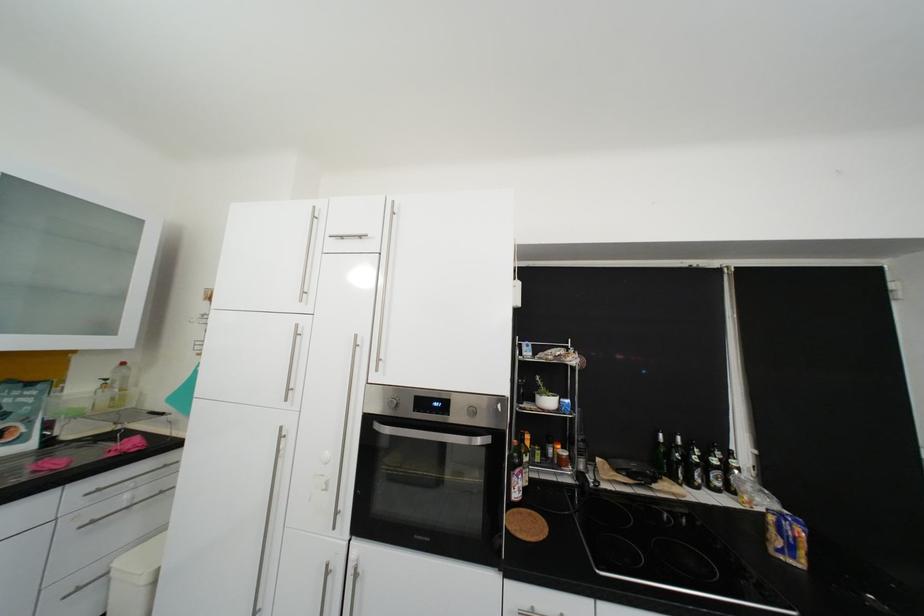
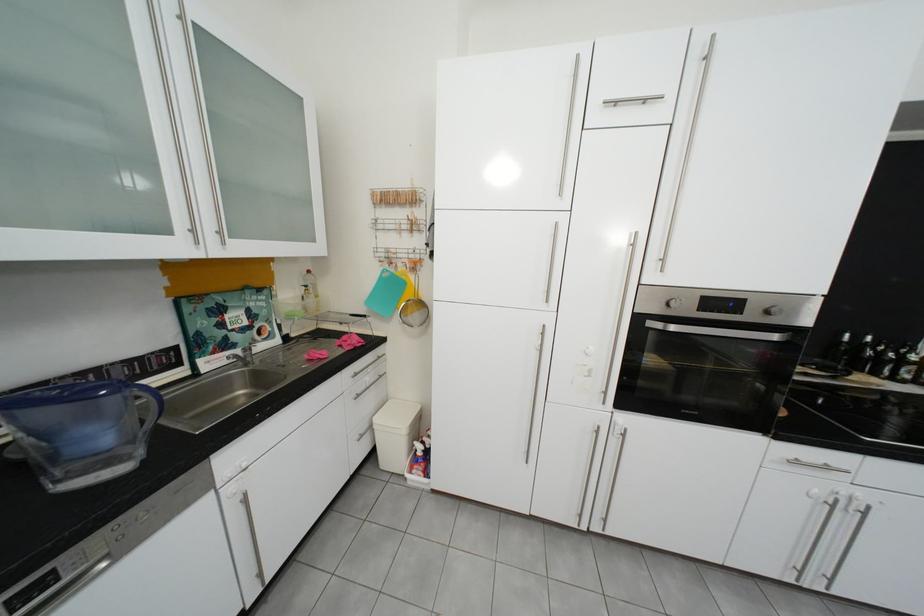
The point at (94, 406) is marked in the first image. Where is the corresponding point in the second image?

(311, 310)